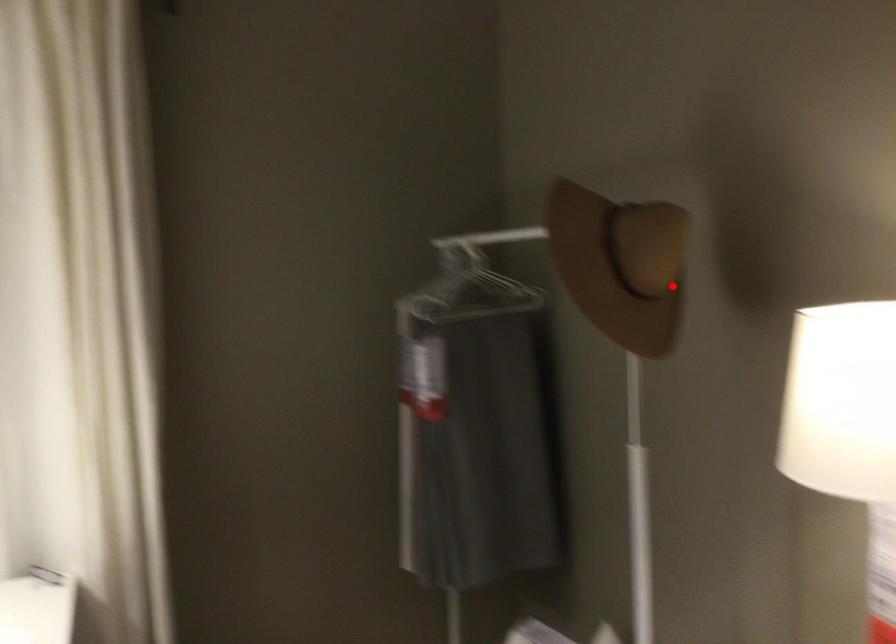
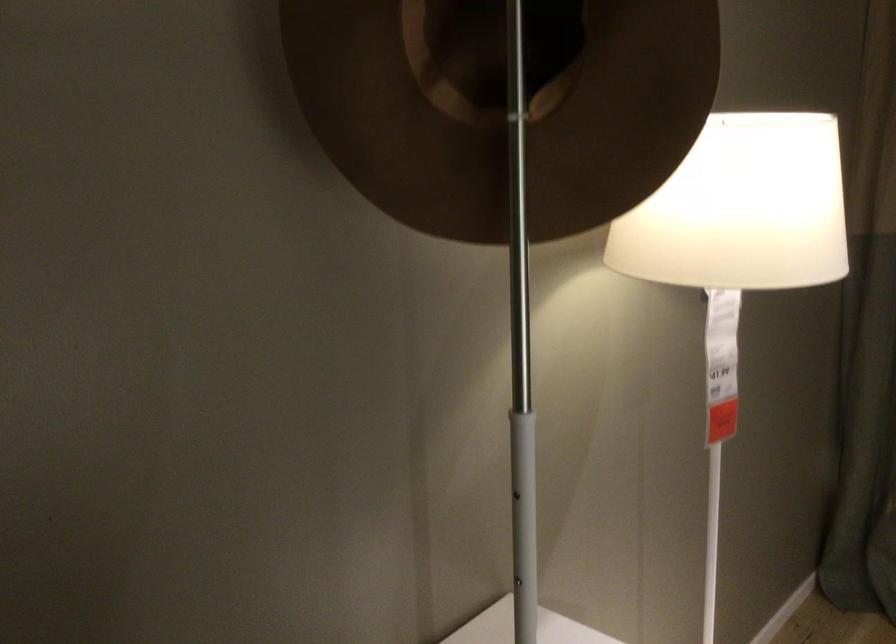
Where in the second image is the point corresponding to the highlighted location from the first image?

(501, 108)